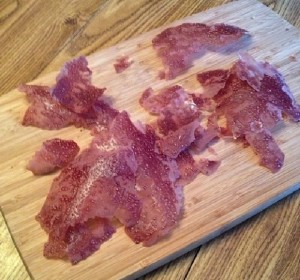
The image size is (300, 280). I want to click on wood cutting board, so click(215, 215).